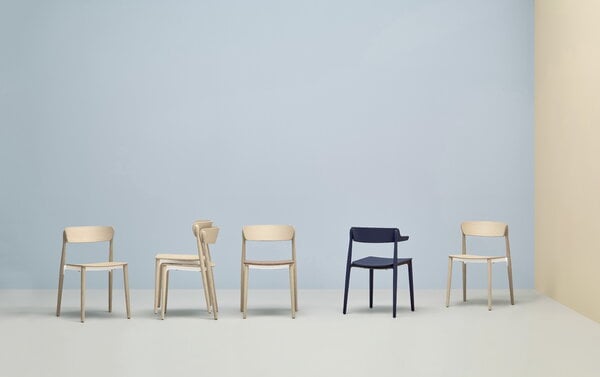
Identify the location of chairs. The height and width of the screenshot is (377, 600). (95, 235), (182, 257), (258, 237), (368, 233), (498, 226).